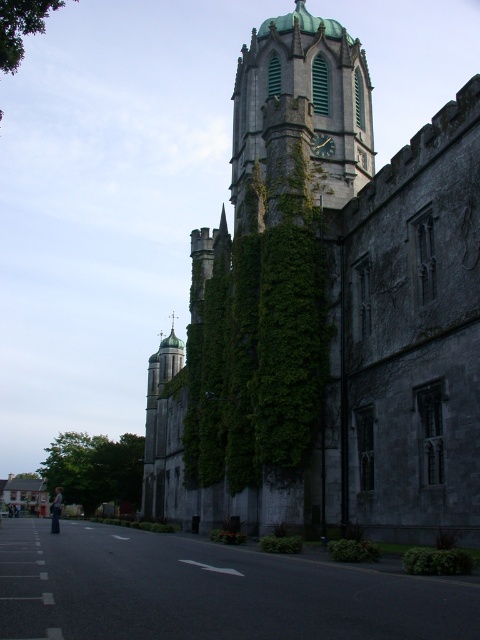
Who is positioned more to the left, green stone clock tower at upper center or dark brown wooden clock at center?

green stone clock tower at upper center is more to the left.

Is green stone clock tower at upper center wider than dark brown wooden clock at center?

Indeed, green stone clock tower at upper center has a greater width compared to dark brown wooden clock at center.

At what (x,y) coordinates should I click in order to perform the action: click on green stone clock tower at upper center. Please return your answer as a coordinate pair (x, y). The width and height of the screenshot is (480, 640). Looking at the image, I should click on (307, 99).

Where is `green stone clock tower at upper center`? This screenshot has width=480, height=640. green stone clock tower at upper center is located at coordinates (307, 99).

Is point (27, 19) positioned after point (328, 150)?

That is False.

Does green leafy tree at upper left have a lesser height compared to dark brown wooden clock at center?

No.

Describe the element at coordinates (21, 28) in the screenshot. The height and width of the screenshot is (640, 480). I see `green leafy tree at upper left` at that location.

Locate an element on the screen. green leafy tree at upper left is located at coordinates (21, 28).

Does point (267, 28) lie in front of point (370, 122)?

Yes, it is.

Does gray stone castle at center have a larger size compared to green stone clock tower at upper center?

Yes, gray stone castle at center is bigger than green stone clock tower at upper center.

Is point (300, 13) farther from viewer compared to point (338, 128)?

Yes.

Locate an element on the screen. This screenshot has height=640, width=480. gray stone castle at center is located at coordinates (326, 314).